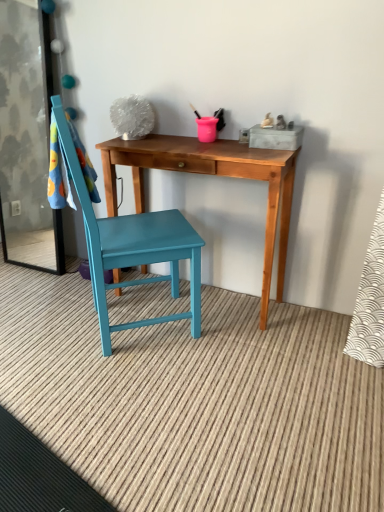
Question: Considering the relative sizes of wooden desk at center and transparent glass screen door at left in the image provided, is wooden desk at center smaller than transparent glass screen door at left?

Choices:
 (A) no
 (B) yes

Answer: (A)

Question: Can you confirm if wooden desk at center is taller than transparent glass screen door at left?

Choices:
 (A) no
 (B) yes

Answer: (A)

Question: Is wooden desk at center positioned far away from transparent glass screen door at left?

Choices:
 (A) yes
 (B) no

Answer: (A)

Question: Does wooden desk at center have a larger size compared to transparent glass screen door at left?

Choices:
 (A) no
 (B) yes

Answer: (B)

Question: Considering the relative positions of wooden desk at center and transparent glass screen door at left in the image provided, is wooden desk at center to the left of transparent glass screen door at left from the viewer's perspective?

Choices:
 (A) yes
 (B) no

Answer: (B)

Question: Is transparent glass screen door at left inside or outside of wooden desk at center?

Choices:
 (A) outside
 (B) inside

Answer: (A)

Question: Looking at the image, does transparent glass screen door at left seem bigger or smaller compared to wooden desk at center?

Choices:
 (A) big
 (B) small

Answer: (B)

Question: From a real-world perspective, relative to wooden desk at center, is transparent glass screen door at left vertically above or below?

Choices:
 (A) above
 (B) below

Answer: (A)

Question: From the image's perspective, is transparent glass screen door at left above or below wooden desk at center?

Choices:
 (A) above
 (B) below

Answer: (A)

Question: Considering the positions of teal painted wood chair at center and wooden desk at center in the image, is teal painted wood chair at center wider or thinner than wooden desk at center?

Choices:
 (A) wide
 (B) thin

Answer: (A)

Question: Is teal painted wood chair at center inside or outside of wooden desk at center?

Choices:
 (A) inside
 (B) outside

Answer: (B)

Question: From a real-world perspective, is teal painted wood chair at center physically located above or below wooden desk at center?

Choices:
 (A) below
 (B) above

Answer: (B)

Question: Is point (180, 224) closer or farther from the camera than point (162, 153)?

Choices:
 (A) closer
 (B) farther

Answer: (B)

Question: In terms of width, does wooden desk at center look wider or thinner when compared to transparent glass screen door at left?

Choices:
 (A) wide
 (B) thin

Answer: (A)

Question: From their relative heights in the image, would you say wooden desk at center is taller or shorter than transparent glass screen door at left?

Choices:
 (A) tall
 (B) short

Answer: (B)